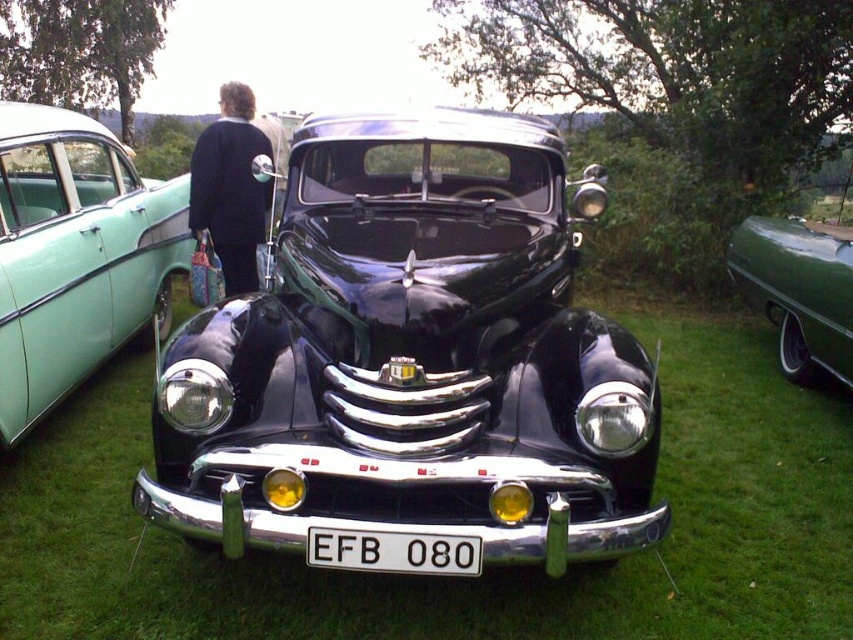
Is point (804, 417) positioned before point (228, 106)?

Yes, point (804, 417) is in front of point (228, 106).

Between point (688, 600) and point (221, 212), which one is positioned in front?

Point (688, 600)

What do you see at coordinates (486, 570) in the screenshot?
I see `green grass at center` at bounding box center [486, 570].

Where is `green grass at center`? This screenshot has height=640, width=853. green grass at center is located at coordinates (486, 570).

What do you see at coordinates (415, 356) in the screenshot? This screenshot has height=640, width=853. I see `shiny black car at center` at bounding box center [415, 356].

The image size is (853, 640). What are the coordinates of `shiny black car at center` in the screenshot? It's located at (415, 356).

Describe the element at coordinates (74, 253) in the screenshot. I see `teal glossy sedan at left` at that location.

Between teal glossy sedan at left and black fabric bag at left, which one appears on the right side from the viewer's perspective?

black fabric bag at left is more to the right.

What do you see at coordinates (74, 253) in the screenshot?
I see `teal glossy sedan at left` at bounding box center [74, 253].

Find the location of a particular element. The width and height of the screenshot is (853, 640). teal glossy sedan at left is located at coordinates (74, 253).